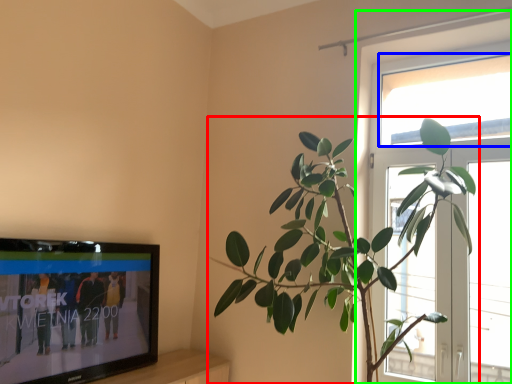
Question: Estimate the real-world distances between objects in this image. Which object is closer to houseplant (highlighted by a red box), window screen (highlighted by a blue box) or window (highlighted by a green box)?

Choices:
 (A) window screen
 (B) window

Answer: (B)